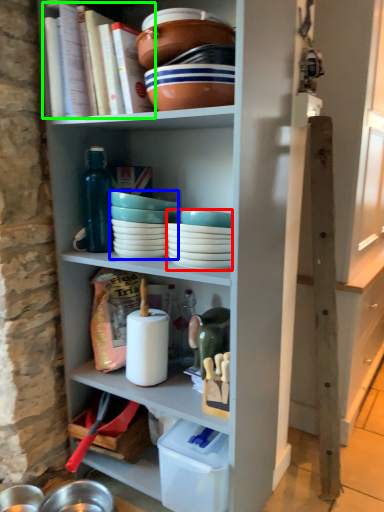
Question: Estimate the real-world distances between objects in this image. Which object is farther from tableware (highlighted by a red box), tableware (highlighted by a blue box) or book (highlighted by a green box)?

Choices:
 (A) tableware
 (B) book

Answer: (B)